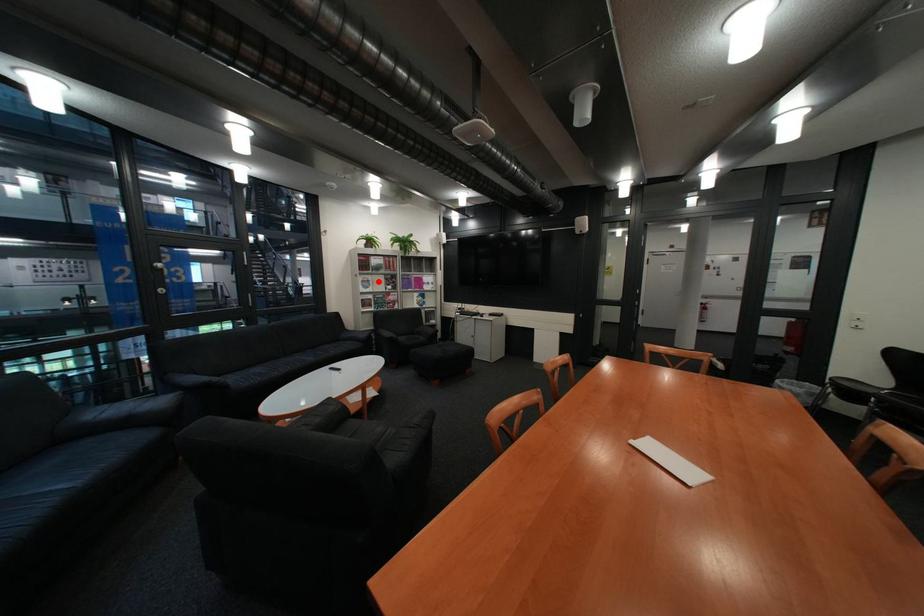
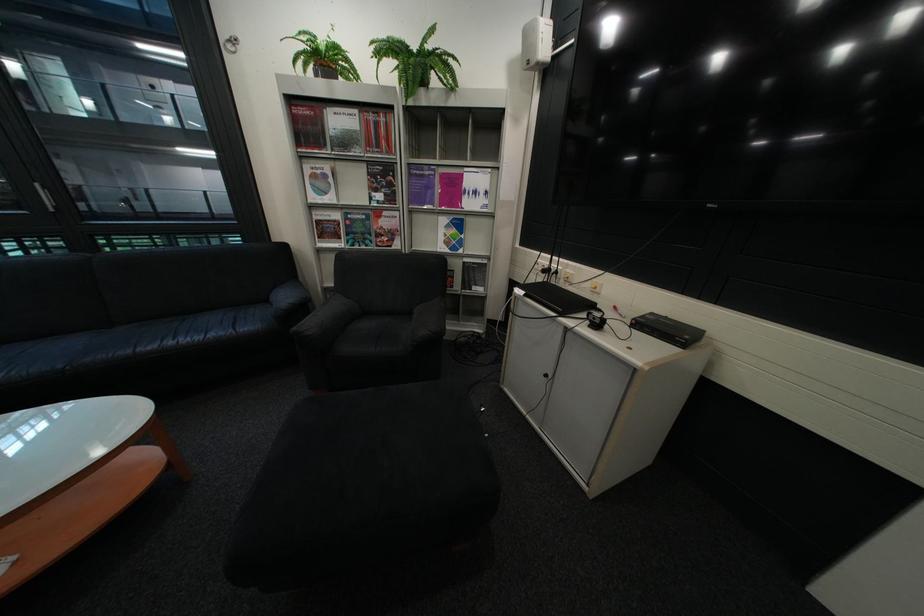
Find the pixel in the second image that matches the highlighted location in the first image.

(329, 177)